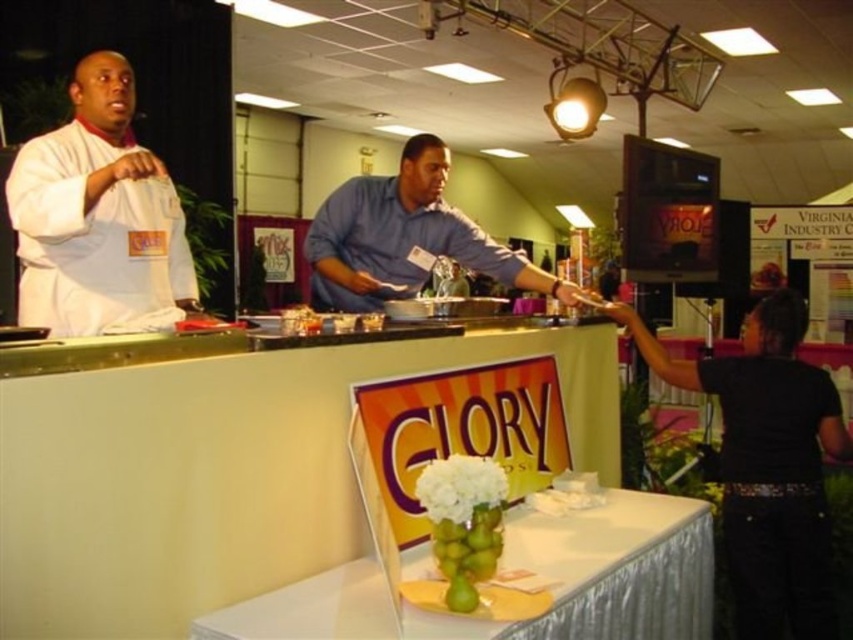
Image resolution: width=853 pixels, height=640 pixels. Identify the location of green glass vase at center. (526, 579).

The image size is (853, 640). Identify the location of green glass vase at center. (526, 579).

Is green glass vase at center shorter than black fabric shirt at right?

Yes.

Where is `green glass vase at center`? This screenshot has width=853, height=640. green glass vase at center is located at coordinates (526, 579).

Can you confirm if black fabric shirt at right is positioned to the left of blue cotton shirt at center?

Incorrect, black fabric shirt at right is not on the left side of blue cotton shirt at center.

Between black fabric shirt at right and blue cotton shirt at center, which one is positioned lower?

Positioned lower is black fabric shirt at right.

Describe the element at coordinates (769, 465) in the screenshot. I see `black fabric shirt at right` at that location.

Where is `black fabric shirt at right`? The width and height of the screenshot is (853, 640). black fabric shirt at right is located at coordinates (769, 465).